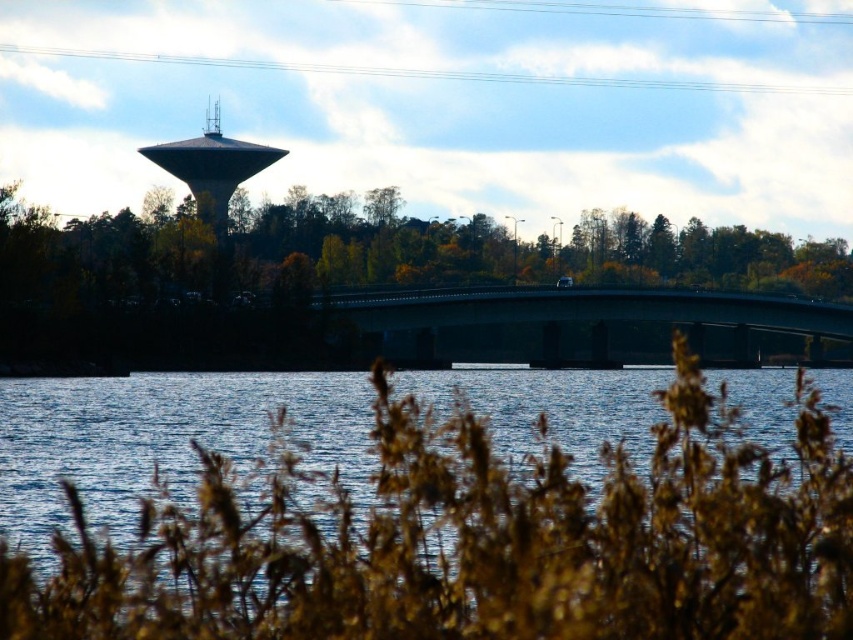
Which is more to the right, green leafy trees at center or green concrete bridge at center?

Positioned to the right is green concrete bridge at center.

Does green leafy trees at center have a lesser height compared to green concrete bridge at center?

In fact, green leafy trees at center may be taller than green concrete bridge at center.

Which is in front, point (544, 276) or point (706, 323)?

Point (706, 323) is in front.

The width and height of the screenshot is (853, 640). In order to click on green leafy trees at center in this screenshot , I will do `click(529, 252)`.

Does green leafy trees at center lie behind matte gray water tower at upper center?

That is False.

Who is more distant from viewer, (0, 225) or (276, 156)?

Point (276, 156)

You are a GUI agent. You are given a task and a screenshot of the screen. Output one action in this format:
    pyautogui.click(x=<x>, y=<y>)
    Task: Click on the green leafy trees at center
    
    Given the screenshot: What is the action you would take?
    pyautogui.click(x=529, y=252)

Looking at this image, does green concrete bridge at center have a greater height compared to matte gray water tower at upper center?

Incorrect, green concrete bridge at center's height is not larger of matte gray water tower at upper center's.

Is green concrete bridge at center to the left of matte gray water tower at upper center from the viewer's perspective?

Incorrect, green concrete bridge at center is not on the left side of matte gray water tower at upper center.

Image resolution: width=853 pixels, height=640 pixels. What do you see at coordinates (583, 308) in the screenshot? I see `green concrete bridge at center` at bounding box center [583, 308].

Locate an element on the screen. green concrete bridge at center is located at coordinates (583, 308).